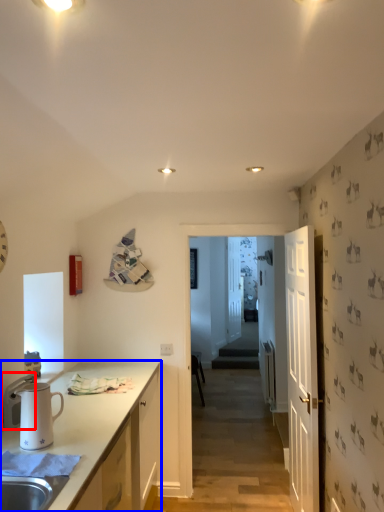
Question: Which point is closer to the camera, appliance (highlighted by a red box) or cabinetry (highlighted by a blue box)?

Choices:
 (A) appliance
 (B) cabinetry

Answer: (B)